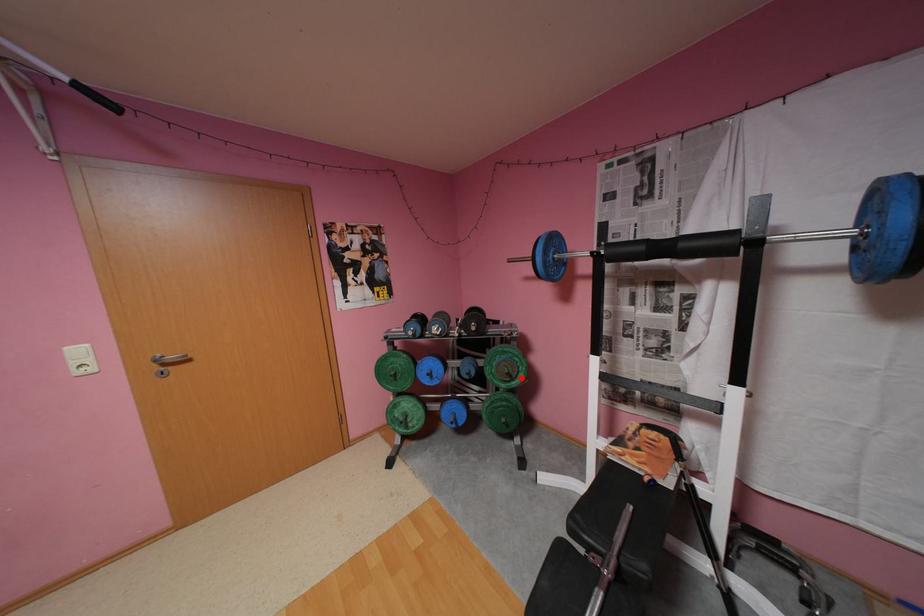
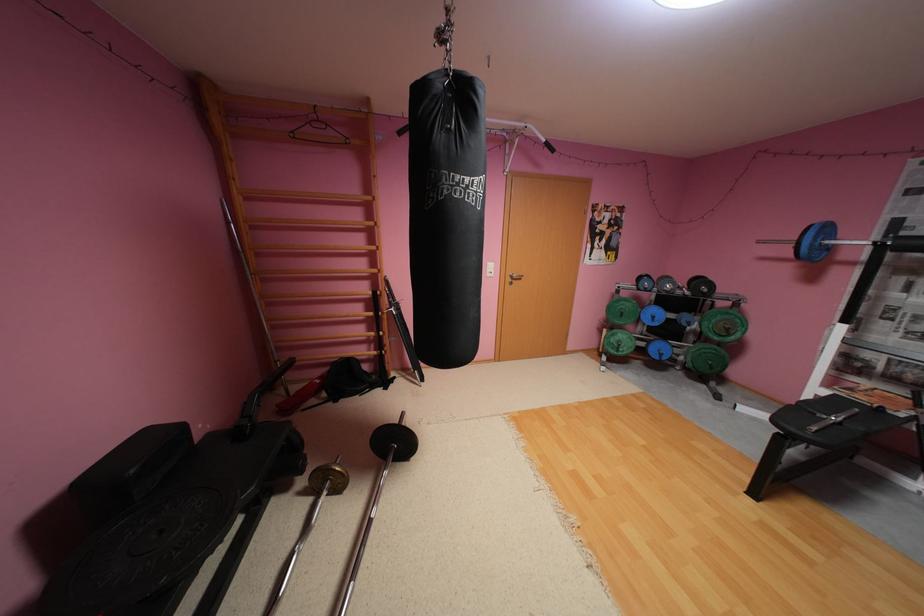
The point at the highlighted location is marked in the first image. Where is the corresponding point in the second image?

(737, 334)